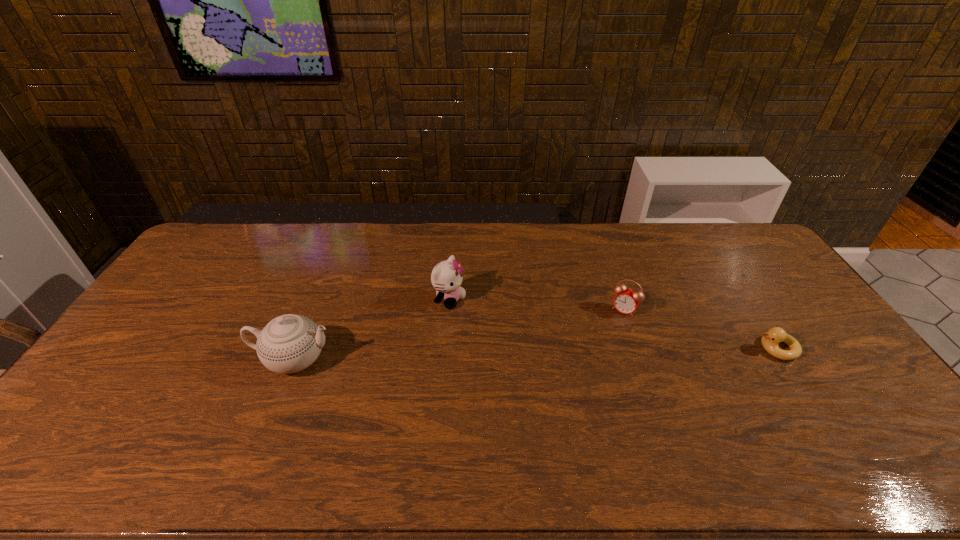
What are the coordinates of `vacant space at the far left corner of the desktop` in the screenshot? It's located at (228, 236).

Where is `free space between the second shortest object and the kitten`? Image resolution: width=960 pixels, height=540 pixels. free space between the second shortest object and the kitten is located at coordinates (537, 304).

What are the coordinates of `empty location between the alarm clock and the shortest object` in the screenshot? It's located at (700, 329).

Find the location of a particular element. empty space between the leftmost object and the shortest object is located at coordinates (536, 354).

The image size is (960, 540). Identify the location of free point between the chinaware and the rightmost object. tap(536, 354).

This screenshot has width=960, height=540. Identify the location of empty space that is in between the leftmost object and the second object from left to right. (372, 329).

This screenshot has height=540, width=960. What are the coordinates of `free point between the duckling and the third object from left to right` in the screenshot? It's located at (x=700, y=329).

Locate an element on the screen. This screenshot has width=960, height=540. free space between the third object from right to left and the duckling is located at coordinates (613, 323).

You are a GUI agent. You are given a task and a screenshot of the screen. Output one action in this format:
    pyautogui.click(x=<x>, y=<y>)
    Task: Click on the vacant space in between the second object from left to right and the chinaware
    
    Given the screenshot: What is the action you would take?
    pyautogui.click(x=372, y=329)

At what (x,y) coordinates should I click in order to perform the action: click on empty location between the chinaware and the alarm clock. Please return your answer as a coordinate pair (x, y). Looking at the image, I should click on (459, 334).